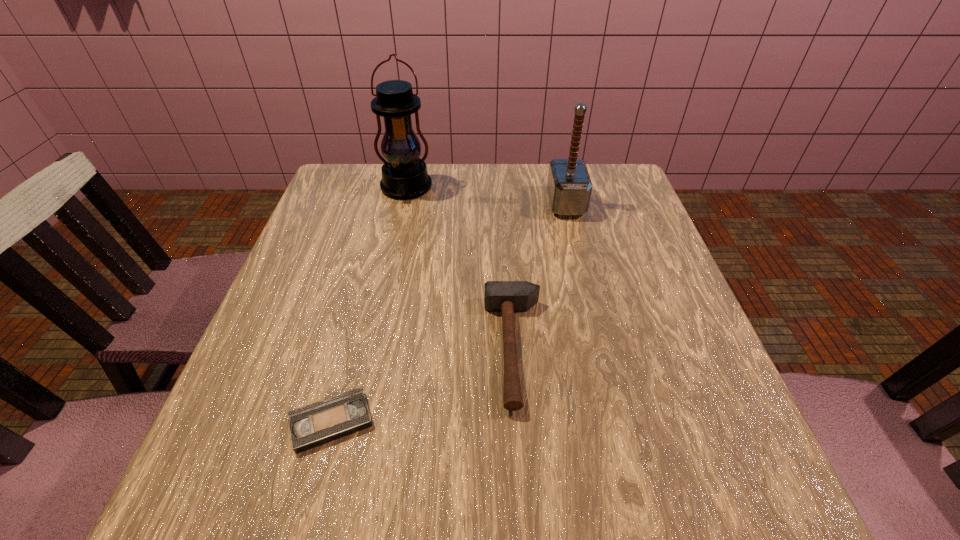
I want to click on the tallest object, so click(x=404, y=175).

Locate an element on the screen. The width and height of the screenshot is (960, 540). the taller hammer is located at coordinates (569, 186).

Identify the location of the second tallest object. This screenshot has height=540, width=960. (569, 186).

Identify the location of the left hammer. The image size is (960, 540). (507, 297).

You are a GUI agent. You are given a task and a screenshot of the screen. Output one action in this format:
    pyautogui.click(x=<x>, y=<y>)
    Task: Click on the second object from right to left
    The width and height of the screenshot is (960, 540).
    Given the screenshot: What is the action you would take?
    pyautogui.click(x=507, y=297)

This screenshot has height=540, width=960. Find the location of `the shortest object`. the shortest object is located at coordinates (321, 422).

Where is a free space located above the tallest object, indicating its light source? Please provide its 2D coordinates. Your answer should be formatted as a tuple, i.e. [(x, y)], where the tuple contains the x and y coordinates of a point satisfying the conditions above.

[(399, 217)]

Where is `free space located 0.300m on the left of the second tallest object`? The height and width of the screenshot is (540, 960). free space located 0.300m on the left of the second tallest object is located at coordinates (433, 203).

Locate an element on the screen. This screenshot has height=540, width=960. vacant space located 0.130m on the striking surface of the second shortest object is located at coordinates (415, 348).

Locate an element on the screen. The height and width of the screenshot is (540, 960). free space located on the striking surface of the second shortest object is located at coordinates (403, 348).